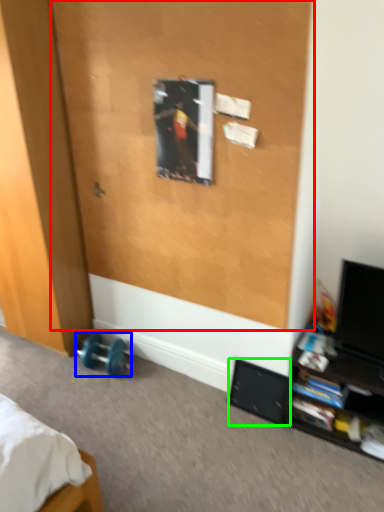
Question: Based on their relative distances, which object is nearer to screen door (highlighted by a red box)? Choose from dumbbell (highlighted by a blue box) and speaker (highlighted by a green box).

Choices:
 (A) dumbbell
 (B) speaker

Answer: (B)